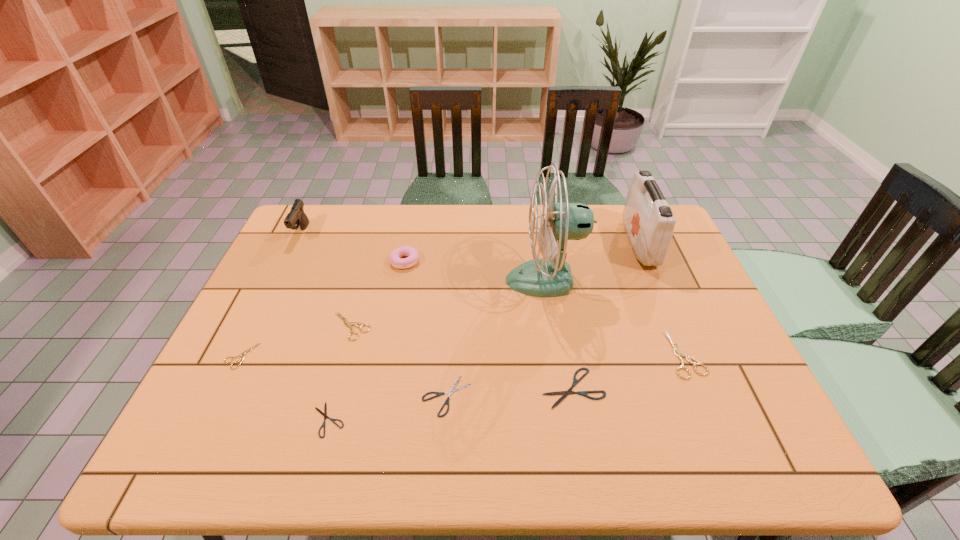
Identify the location of the fifth shortest shears. Image resolution: width=960 pixels, height=540 pixels. (349, 324).

The image size is (960, 540). In order to click on the second beige shears from right to left in this screenshot , I will do `click(349, 324)`.

Image resolution: width=960 pixels, height=540 pixels. Identify the location of the rightmost black shears. (584, 393).

Find the location of a particular element. This screenshot has height=540, width=960. the second shears from right to left is located at coordinates (584, 393).

The image size is (960, 540). In order to click on the leftmost beige shears in this screenshot , I will do `click(243, 354)`.

I want to click on the smallest beige shears, so click(243, 354).

Where is `the sixth object from left to right`? This screenshot has height=540, width=960. the sixth object from left to right is located at coordinates [449, 392].

Locate an element on the screen. This screenshot has width=960, height=540. the second biggest black shears is located at coordinates (449, 392).

Where is `the smallest black shears`? This screenshot has width=960, height=540. the smallest black shears is located at coordinates (324, 414).

This screenshot has width=960, height=540. What are the coordinates of `the leftmost black shears` in the screenshot? It's located at (324, 414).